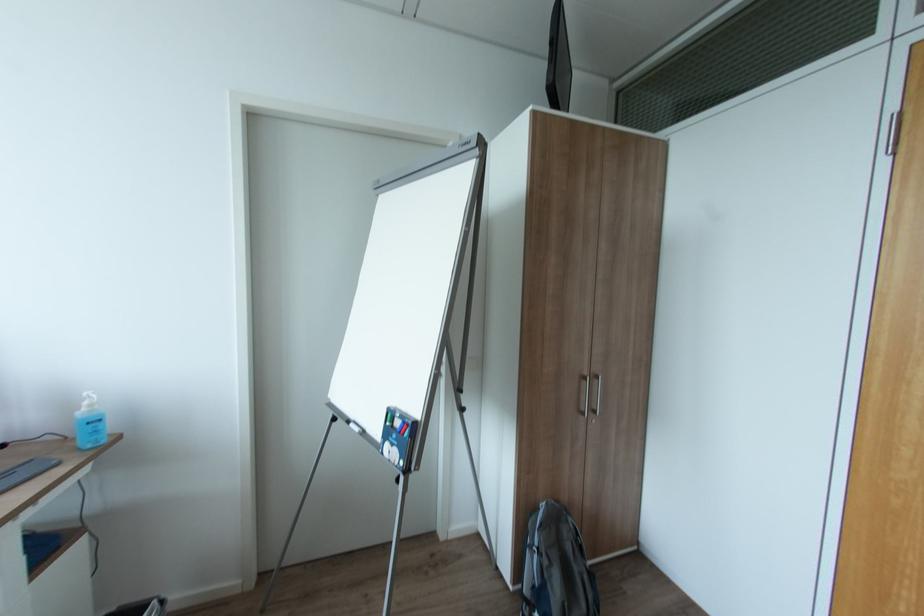
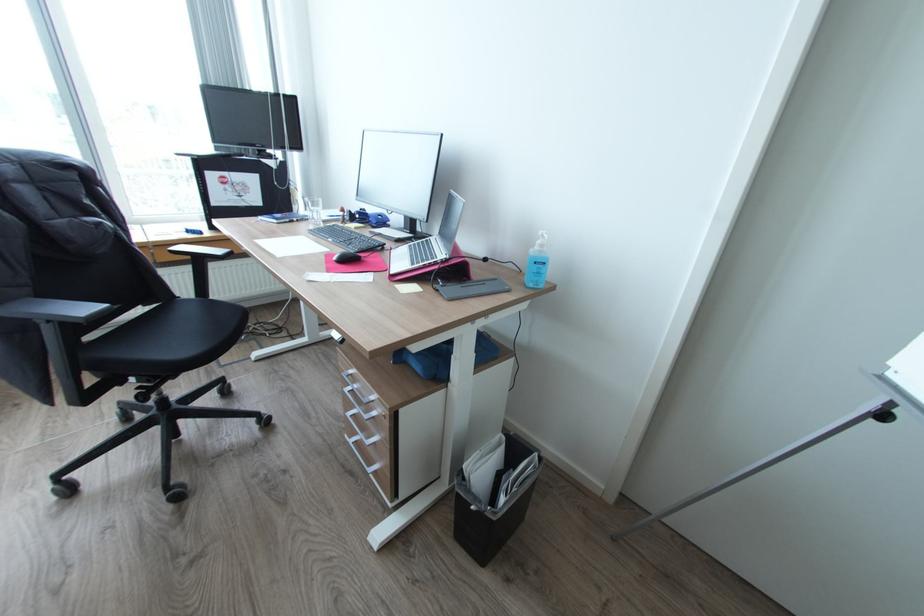
Find the pixel in the second image that matches point (94, 407) in the first image.

(545, 245)